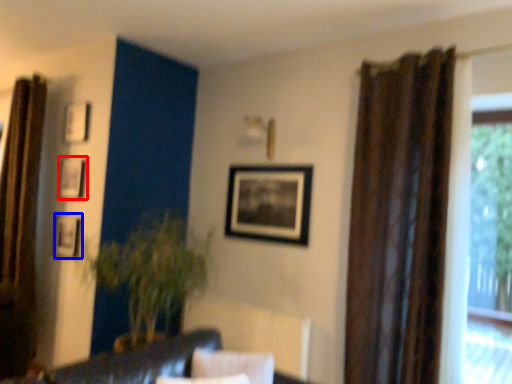
Question: Which object is further to the camera taking this photo, picture frame (highlighted by a red box) or picture frame (highlighted by a blue box)?

Choices:
 (A) picture frame
 (B) picture frame

Answer: (A)